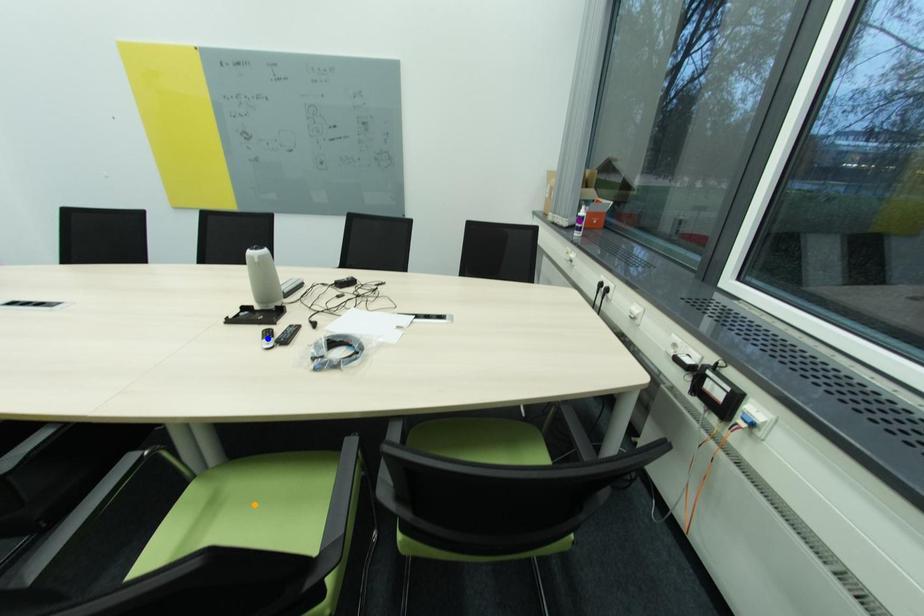
Order these from nearest to farthest:
1. purple point
2. orange point
3. blue point

purple point < blue point < orange point